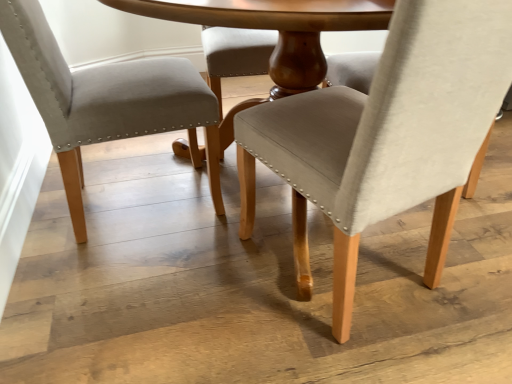
You are a GUI agent. You are given a task and a screenshot of the screen. Output one action in this format:
    pyautogui.click(x=<x>, y=<y>)
    Task: Click on the free point behind beige fabric chair at left, which is the 2th chair from right to left
    This screenshot has height=384, width=512.
    Given the screenshot: What is the action you would take?
    pyautogui.click(x=140, y=152)